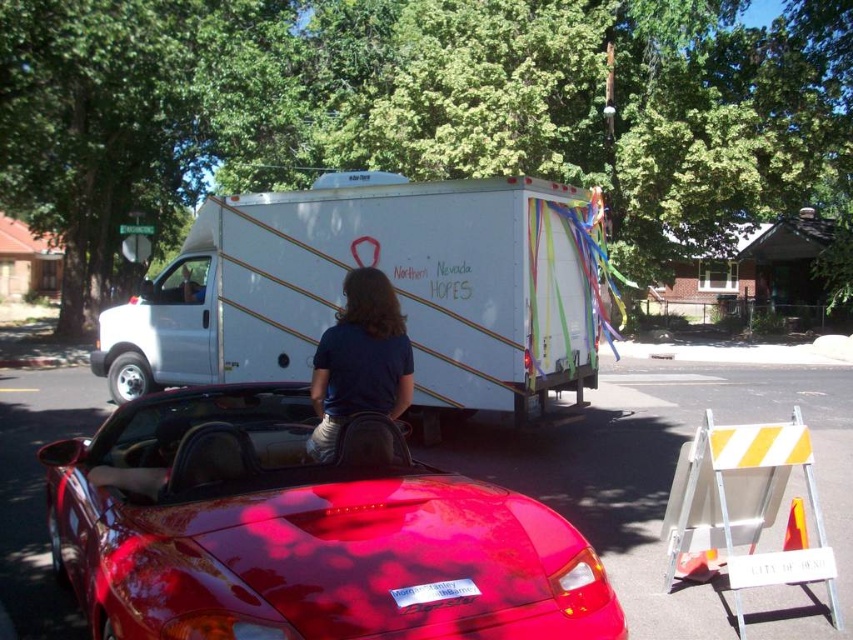
You are a photographer trying to capture both the glossy red convertible at center and the white matte truck at center in a single frame. Given their height difference, which vehicle should you position closer to the camera to ensure both are fully visible in the photo?

The glossy red convertible at center is much taller than the white matte truck at center. To ensure both are fully visible, position the white matte truck at center closer to the camera so its smaller size balances the height difference with the taller convertible.

You are a delivery driver who needs to park your truck between the glossy red convertible at center and the dark blue shirt at center. The truck requires 40 inches of space. Can you fit your truck in the available space between them?

The space between the glossy red convertible at center and the dark blue shirt at center is only 33.76 inches, which is less than the required 40 inches for the truck. Therefore, the truck cannot be parked there.

You are a pedestrian standing on the sidewalk next to the glossy red convertible at center and the white matte truck at center. You want to cross the road to a nearby store. Which vehicle should you move closer to for safety while waiting?

The glossy red convertible at center and white matte truck at center are 7.08 meters apart. To ensure safety while waiting, you should move closer to the white matte truck at center because it is a larger vehicle and may provide better visibility and protection from traffic compared to the smaller glossy red convertible at center.